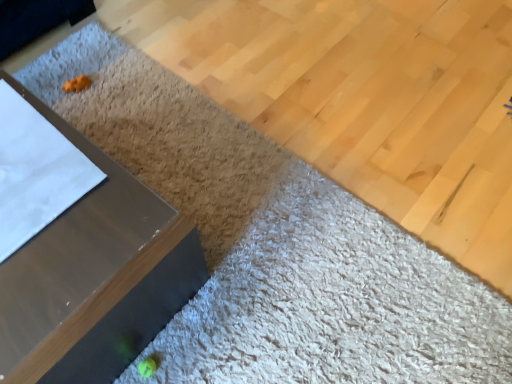
Question: Should I look upward or downward to see metallic gray table at left?

Choices:
 (A) up
 (B) down

Answer: (B)

Question: Is matte wood plywood at lower left facing away from metallic gray table at left?

Choices:
 (A) no
 (B) yes

Answer: (A)

Question: Are matte wood plywood at lower left and metallic gray table at left far apart?

Choices:
 (A) no
 (B) yes

Answer: (A)

Question: From a real-world perspective, is matte wood plywood at lower left below metallic gray table at left?

Choices:
 (A) no
 (B) yes

Answer: (B)

Question: Considering the relative sizes of matte wood plywood at lower left and metallic gray table at left in the image provided, is matte wood plywood at lower left thinner than metallic gray table at left?

Choices:
 (A) yes
 (B) no

Answer: (B)

Question: Can metallic gray table at left be found inside matte wood plywood at lower left?

Choices:
 (A) no
 (B) yes

Answer: (A)

Question: Considering the relative positions of matte wood plywood at lower left and metallic gray table at left in the image provided, is matte wood plywood at lower left in front of metallic gray table at left?

Choices:
 (A) yes
 (B) no

Answer: (B)

Question: Can you confirm if metallic gray table at left is wider than matte wood plywood at lower left?

Choices:
 (A) yes
 (B) no

Answer: (B)

Question: From a real-world perspective, is metallic gray table at left positioned over matte wood plywood at lower left based on gravity?

Choices:
 (A) yes
 (B) no

Answer: (A)

Question: Considering the relative positions of metallic gray table at left and matte wood plywood at lower left in the image provided, is metallic gray table at left to the left of matte wood plywood at lower left from the viewer's perspective?

Choices:
 (A) no
 (B) yes

Answer: (B)

Question: Would you say metallic gray table at left contains matte wood plywood at lower left?

Choices:
 (A) no
 (B) yes

Answer: (A)

Question: Is metallic gray table at left outside of matte wood plywood at lower left?

Choices:
 (A) no
 (B) yes

Answer: (B)

Question: Considering the relative positions of metallic gray table at left and matte wood plywood at lower left in the image provided, is metallic gray table at left to the right of matte wood plywood at lower left from the viewer's perspective?

Choices:
 (A) no
 (B) yes

Answer: (A)

Question: From the image's perspective, is matte wood plywood at lower left positioned above or below metallic gray table at left?

Choices:
 (A) below
 (B) above

Answer: (B)